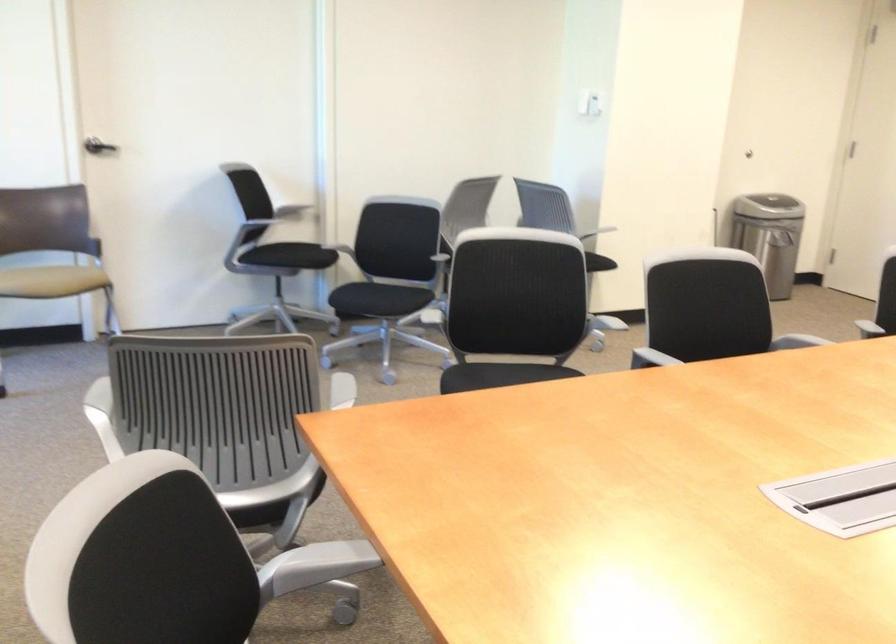
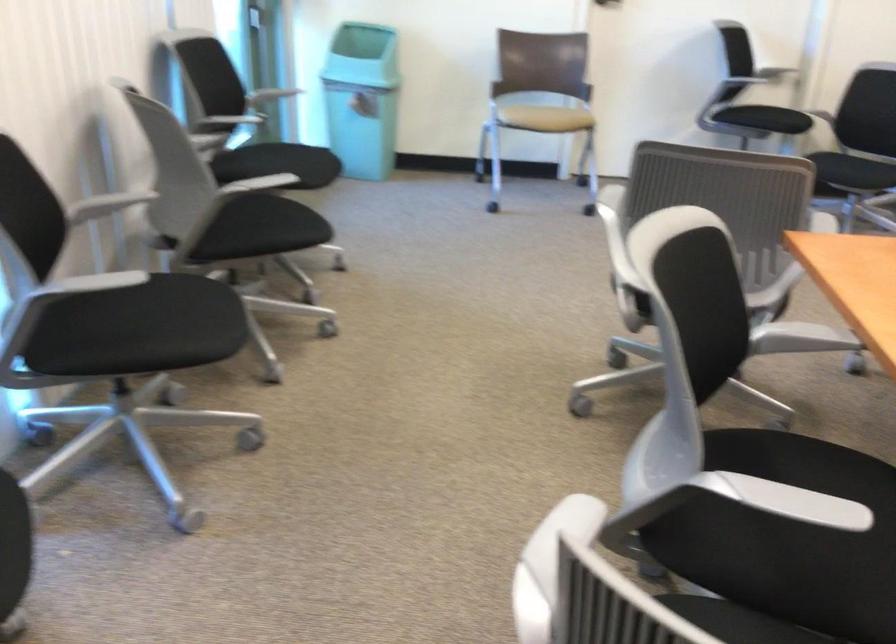
In a continuous first-person perspective shot, in which direction is the camera moving?

The cameraman moved toward left, backward.